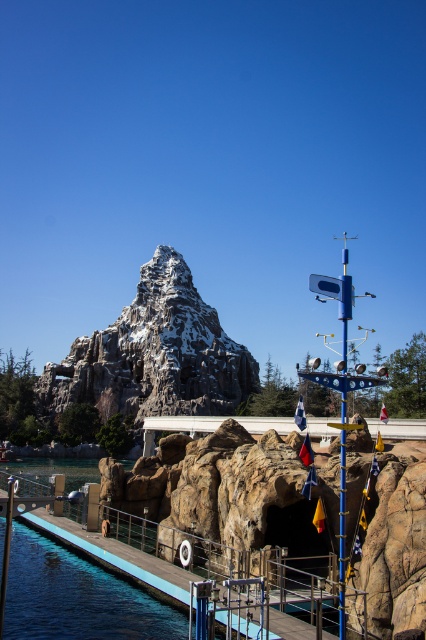
Question: Which point appears farthest from the camera in this image?

Choices:
 (A) (176, 436)
 (B) (160, 276)

Answer: (B)

Question: Is rockymaterial/texturecave at center above snowy rocky mountain at center?

Choices:
 (A) no
 (B) yes

Answer: (A)

Question: Which object is farther from the camera taking this photo?

Choices:
 (A) snowy rocky mountain at center
 (B) rockymaterial/texturecave at center

Answer: (A)

Question: Does rockymaterial/texturecave at center appear under snowy rocky mountain at center?

Choices:
 (A) yes
 (B) no

Answer: (A)

Question: Which point is farther to the camera?

Choices:
 (A) (279, 436)
 (B) (134, 337)

Answer: (B)

Question: Does rockymaterial/texturecave at center lie in front of snowy rocky mountain at center?

Choices:
 (A) yes
 (B) no

Answer: (A)